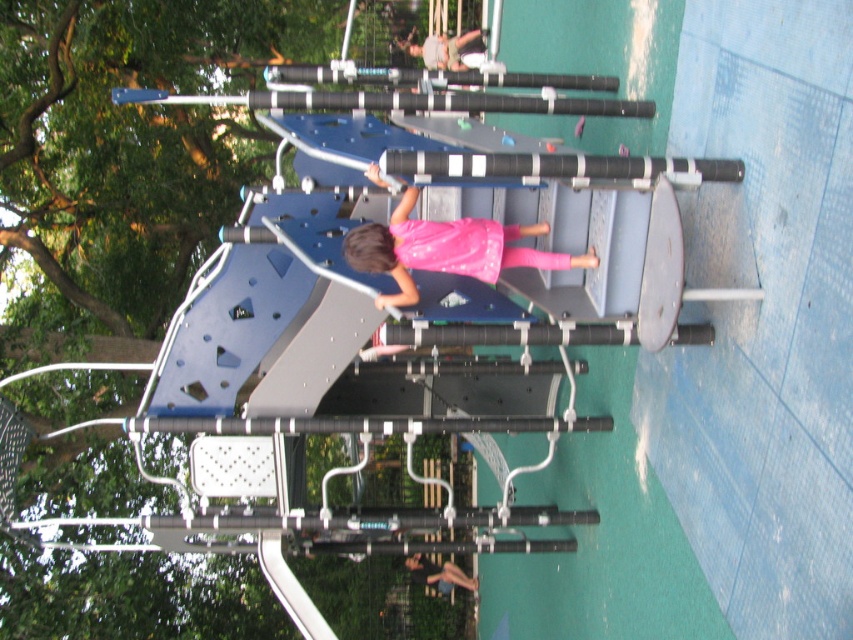
Does pink matte dress at center lie behind pink fabric dress at center?

That is False.

Is point (387, 228) less distant than point (453, 58)?

Yes, point (387, 228) is in front of point (453, 58).

Does point (405, 284) come in front of point (437, 54)?

Yes, it is in front of point (437, 54).

The width and height of the screenshot is (853, 640). Identify the location of pink matte dress at center. (445, 250).